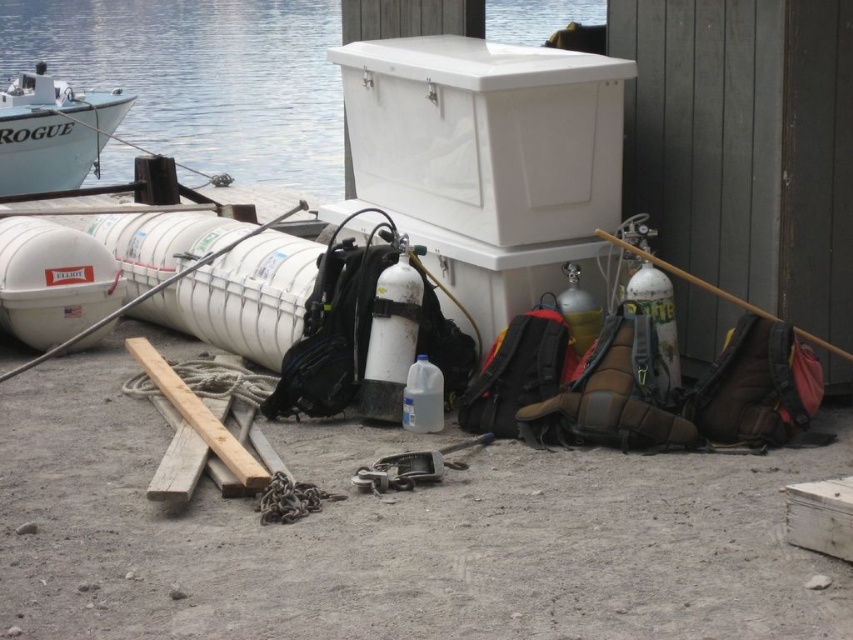
Does point (315, 104) come behind point (190, 419)?

Yes, point (315, 104) is behind point (190, 419).

Does white glossy water at upper left appear over wooden planks at center?

Yes, white glossy water at upper left is above wooden planks at center.

Locate an element on the screen. white glossy water at upper left is located at coordinates (201, 77).

Image resolution: width=853 pixels, height=640 pixels. I want to click on white glossy water at upper left, so click(x=201, y=77).

Can you confirm if white plastic cooler at upper center is bigger than wooden planks at center?

Correct, white plastic cooler at upper center is larger in size than wooden planks at center.

Is white plastic cooler at upper center smaller than wooden planks at center?

No.

Image resolution: width=853 pixels, height=640 pixels. Describe the element at coordinates (486, 134) in the screenshot. I see `white plastic cooler at upper center` at that location.

The image size is (853, 640). I want to click on white plastic cooler at upper center, so click(x=486, y=134).

Who is taller, white glossy water at upper left or white matte life raft at left?

With more height is white glossy water at upper left.

Which of these two, white glossy water at upper left or white matte life raft at left, stands shorter?

white matte life raft at left is shorter.

Identify the location of white glossy water at upper left. (201, 77).

Where is `white glossy water at upper left`? white glossy water at upper left is located at coordinates (201, 77).